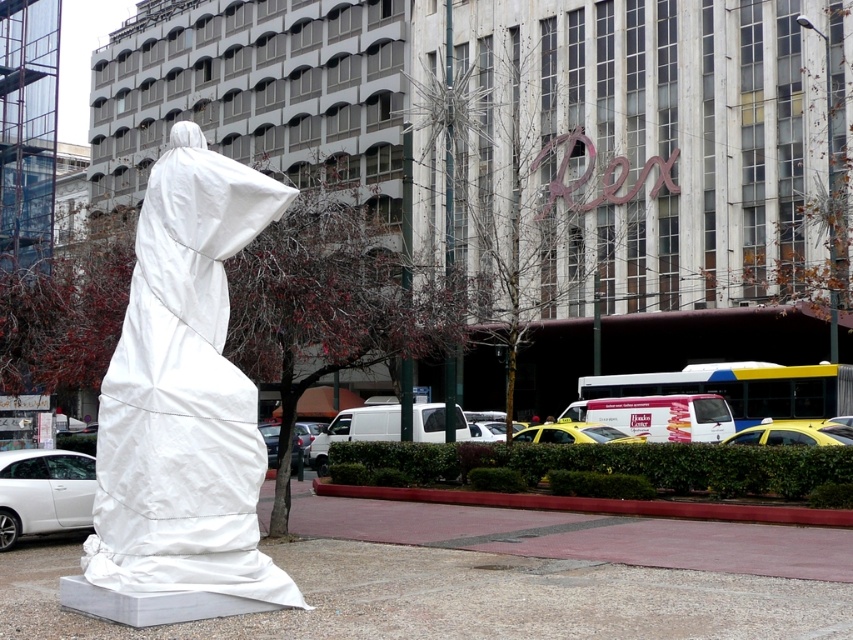
You are a pedestrian standing at the base of the large modern building and see the yellow matte taxi at lower right and the yellow matte taxi at center. Which taxi is closer to you?

The yellow matte taxi at center is closer to you because it is positioned below the yellow matte taxi at lower right, which is higher up in the image.

You are a delivery person needing to park your van between the white matte car at lower left and the yellow matte taxi at lower right. The van is 20 feet long. Can you fit it in the space between them?

The distance between the white matte car at lower left and the yellow matte taxi at lower right is 36.28 feet. Since the van is 20 feet long, there is enough space to park it between them.